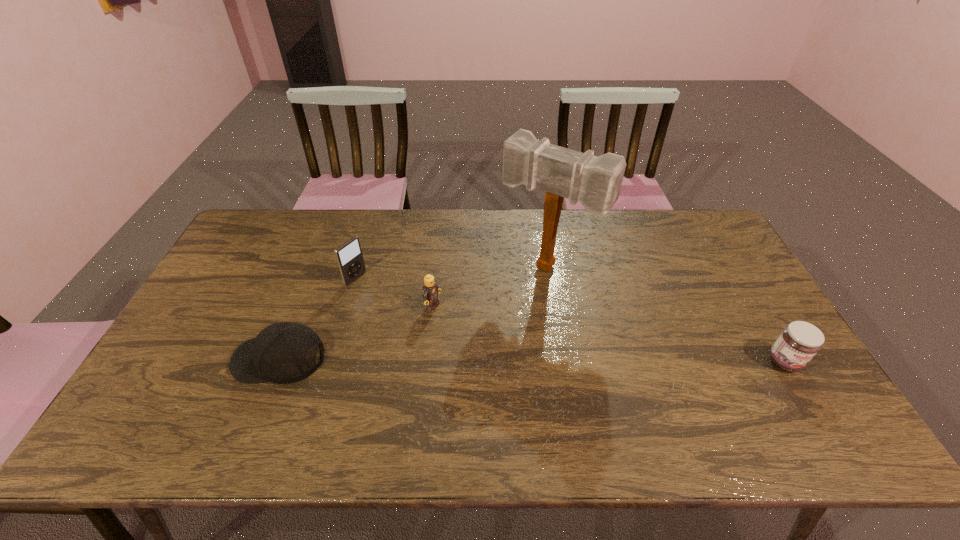
Locate an element on the screen. The width and height of the screenshot is (960, 540). vacant space that is in between the fourth shortest object and the third farthest object is located at coordinates (395, 292).

This screenshot has height=540, width=960. I want to click on vacant space in between the Lego and the fourth shortest object, so click(x=395, y=292).

This screenshot has height=540, width=960. In order to click on vacant point located between the iPod and the cap in this screenshot , I will do `click(317, 318)`.

This screenshot has width=960, height=540. In order to click on vacant area between the Lego and the rightmost object in this screenshot , I will do `click(609, 334)`.

The image size is (960, 540). In order to click on empty location between the third farthest object and the iPod in this screenshot , I will do `click(395, 292)`.

Locate an element on the screen. free space between the fourth shortest object and the fourth object from left to right is located at coordinates (451, 273).

The image size is (960, 540). Find the location of `free space between the cap and the third nearest object`. free space between the cap and the third nearest object is located at coordinates pos(356,332).

The width and height of the screenshot is (960, 540). I want to click on vacant space that's between the cap and the second tallest object, so click(x=317, y=318).

Locate an element on the screen. This screenshot has width=960, height=540. the closest object to the fourth object from left to right is located at coordinates pyautogui.click(x=430, y=292).

Identify which object is the second nearest to the iPod. Please provide its 2D coordinates. Your answer should be formatted as a tuple, i.e. [(x, y)], where the tuple contains the x and y coordinates of a point satisfying the conditions above.

[(430, 292)]